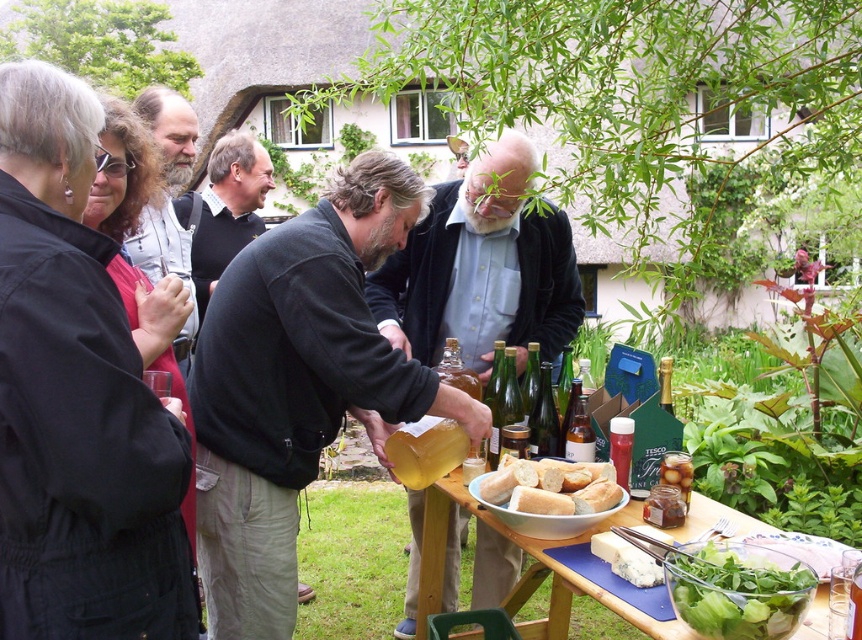
Based on the photo, you are organizing a picnic and need to pack both the smooth brown leather jacket at center and the green leafy salad at lower right into a backpack. The backpack has a compartment that can only fit items smaller than the jacket. Which item should you place in the compartment?

The green leafy salad at lower right should be placed in the compartment since it is smaller than the smooth brown leather jacket at center.